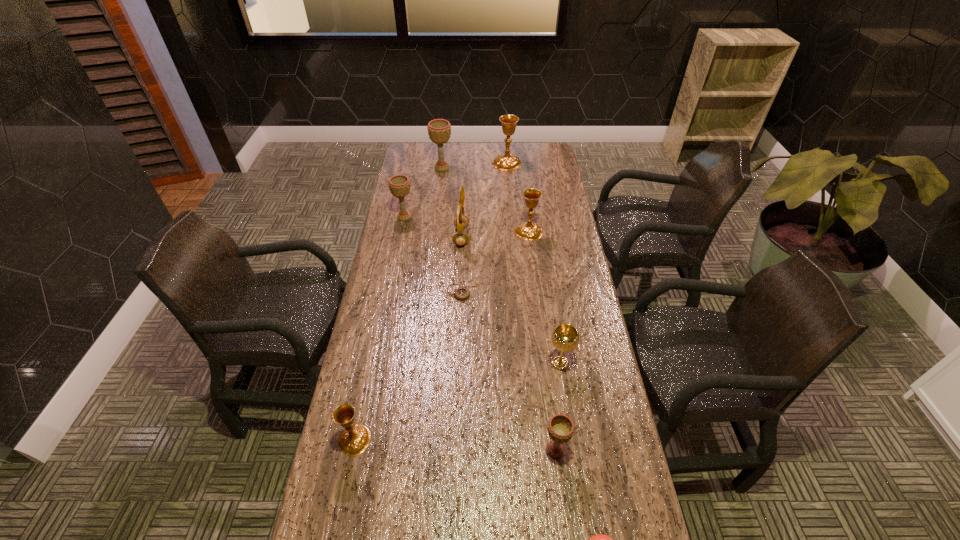
Point out which chalice is positioned as the second nearest to the leftmost gold chalice. Please provide its 2D coordinates. Your answer should be formatted as a tuple, i.e. [(x, y)], where the tuple contains the x and y coordinates of a point satisfying the conditions above.

[(565, 337)]

Point out which gold chalice is positioned as the third nearest to the apple. Please provide its 2D coordinates. Your answer should be formatted as a tuple, i.e. [(x, y)], where the tuple contains the x and y coordinates of a point satisfying the conditions above.

[(505, 162)]

Identify which gold chalice is located as the second nearest to the second nearest gold chalice. Please provide its 2D coordinates. Your answer should be formatted as a tuple, i.e. [(x, y)], where the tuple contains the x and y coordinates of a point satisfying the conditions above.

[(354, 439)]

This screenshot has width=960, height=540. In order to click on beige chalice that can be found as the closest to the farthest gold chalice in this screenshot , I will do `click(439, 130)`.

Identify which beige chalice is located as the nearest to the fifth chalice from right to left. Please provide its 2D coordinates. Your answer should be formatted as a tuple, i.e. [(x, y)], where the tuple contains the x and y coordinates of a point satisfying the conditions above.

[(399, 185)]

This screenshot has height=540, width=960. Identify the location of free location that satisfies the following two spatial constraints: 1. on the back side of the fifth nearest object; 2. on the right side of the second farthest gold chalice. (465, 232).

Image resolution: width=960 pixels, height=540 pixels. Find the location of `blank space that satisfies the following two spatial constraints: 1. on the back side of the leftmost beige chalice; 2. on the right side of the farthest gold chalice`. blank space that satisfies the following two spatial constraints: 1. on the back side of the leftmost beige chalice; 2. on the right side of the farthest gold chalice is located at coordinates (415, 163).

Locate an element on the screen. free space that satisfies the following two spatial constraints: 1. on the back side of the nearest gold chalice; 2. on the left side of the leftmost beige chalice is located at coordinates (400, 217).